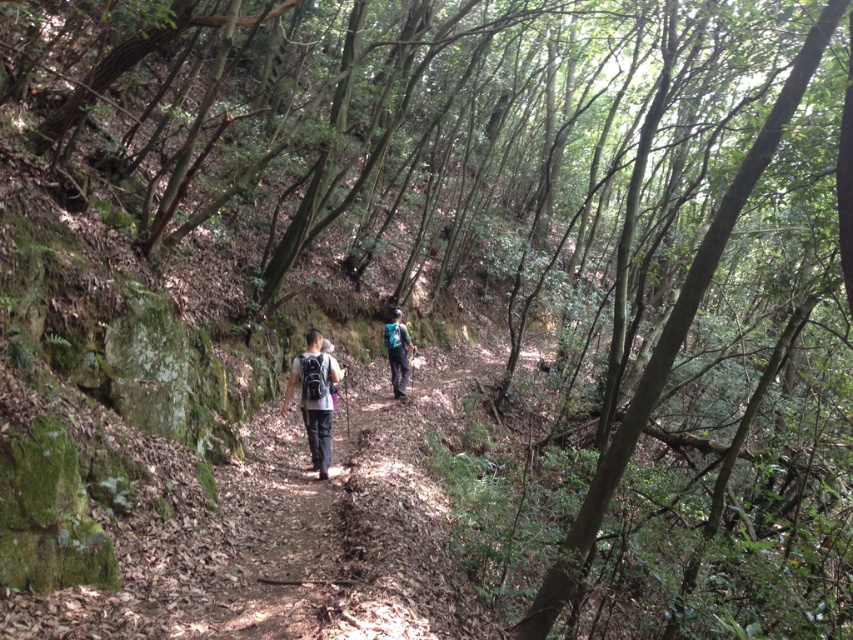
You are hiking on a forest trail and see both the matte black backpack at center and the blue fabric backpack at center. Which backpack is nearer to you?

The matte black backpack at center is closer to the viewer than the blue fabric backpack at center, so the matte black backpack at center is nearer to you.

You are standing on the forest trail and see the matte black backpack at center. If you want to reach the backpack quickly, should you walk towards it directly or take a detour around the large tree on your left?

The matte black backpack at center is 8.41 meters away from viewer. Since the backpack is directly ahead and the distance is straightforward, walking directly towards it would be the quickest path rather than taking a detour around the large tree on your left.